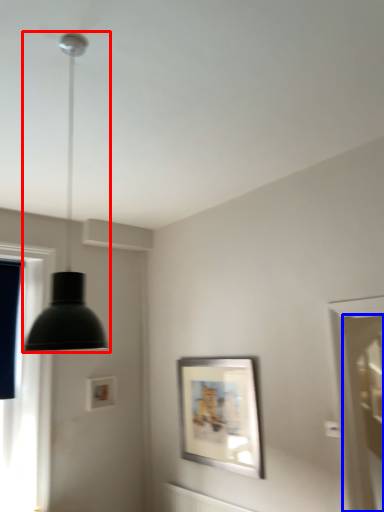
Question: Which object appears farthest to the camera in this image, lamp (highlighted by a red box) or screen door (highlighted by a blue box)?

Choices:
 (A) lamp
 (B) screen door

Answer: (B)